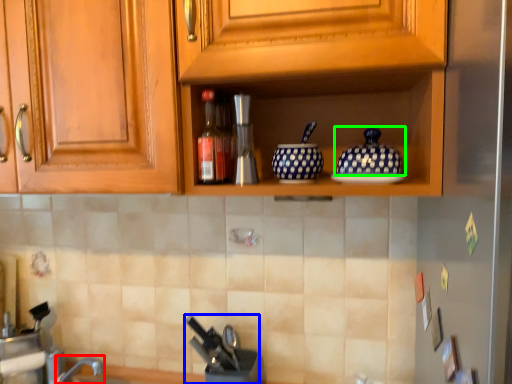
Question: Which object is positioned farthest from faucet (highlighted by a red box)? Select from appliance (highlighted by a blue box) and pottery (highlighted by a green box).

Choices:
 (A) appliance
 (B) pottery

Answer: (B)